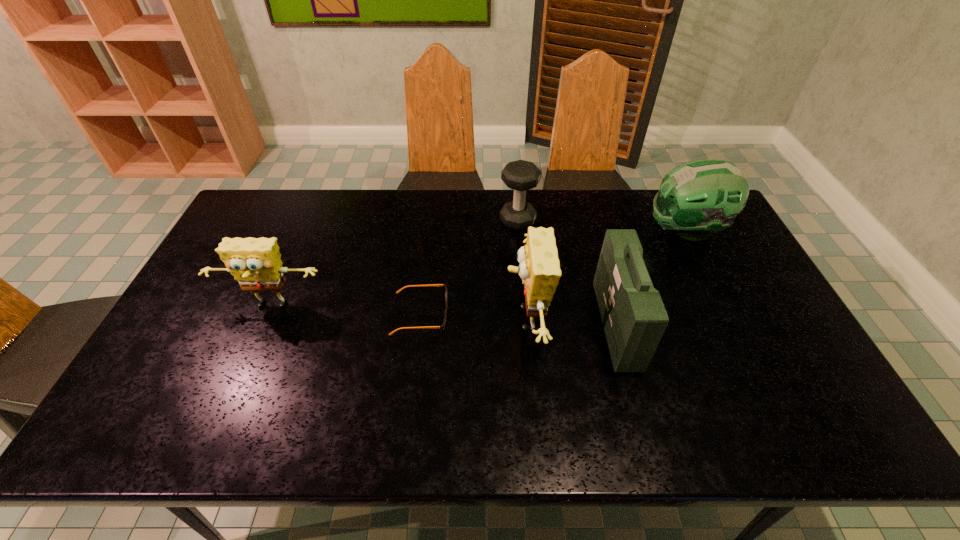
Identify the location of object that stands as the closest to the shortest object. (539, 268).

Identify the location of free space that satisfies the following two spatial constraints: 1. on the visor of the rightmost object; 2. on the face of the shorter sponge. The image size is (960, 540). (724, 307).